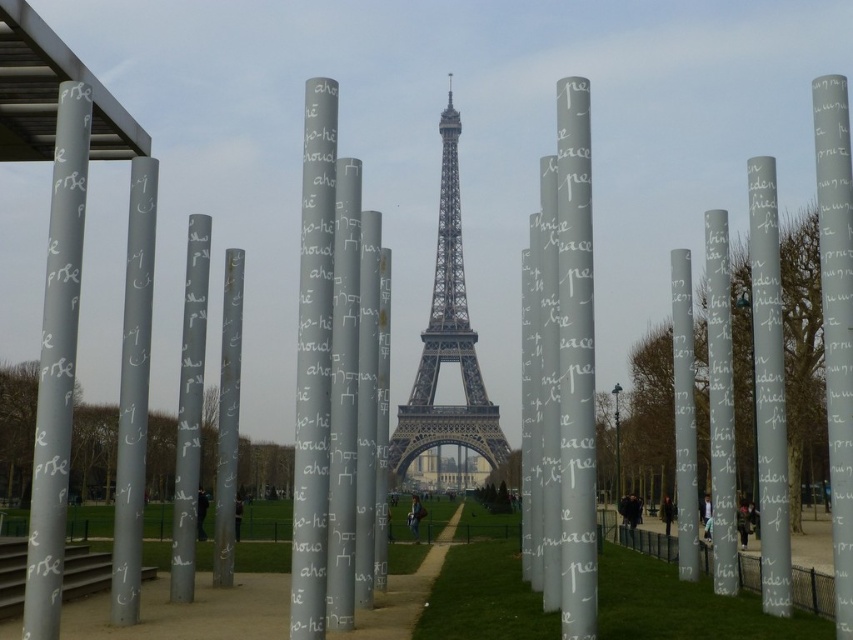
You are a tourist standing at the entrance of the park and want to reach the Eiffel Tower. You see a smooth concrete path at center and a gray metallic pole at center. Which path should you take to get closer to the Eiffel Tower?

The smooth concrete path at center is positioned under gray metallic pole at center, so taking the smooth concrete path at center would lead you closer to the Eiffel Tower since it is directly beneath the pole which is aligned towards the tower.

You are standing in front of the columns and want to take a photo that includes both the columns and the Eiffel Tower in the background. Which of the two points, point 1 at coordinates point (49, 592) or point 2 at coordinates point (761, 189), should you focus on to ensure both elements are in focus?

You should focus on point 2 at coordinates point (761, 189) because it is farther from the camera, ensuring that both the closer columns and the distant Eiffel Tower will be in focus.

You are a photographer standing in front of the silver metallic pillar at left and the silver polished column at right. You want to capture a photo where both objects are visible in the frame. Which object should you focus on first to ensure both are in the frame?

You should focus on the silver polished column at right first because the silver metallic pillar at left is located above it, so adjusting the camera angle to include the lower positioned silver polished column at right will naturally include the higher silver metallic pillar at left in the frame.